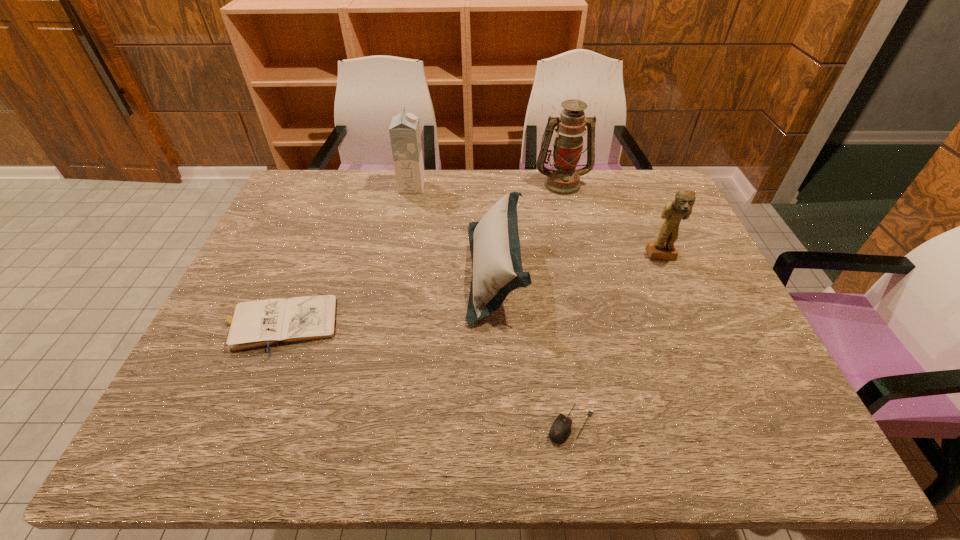
In order to click on vacant region between the figurine and the leftmost object in this screenshot , I will do `click(469, 291)`.

This screenshot has height=540, width=960. Identify the location of free area in between the nearest object and the oil lamp. (566, 303).

Identify the location of free space between the leftmost object and the carton. (346, 256).

Image resolution: width=960 pixels, height=540 pixels. Identify the location of free spot between the third object from left to right and the oil lamp. (529, 228).

Point out which object is positioned as the third nearest to the third tallest object. Please provide its 2D coordinates. Your answer should be formatted as a tuple, i.e. [(x, y)], where the tuple contains the x and y coordinates of a point satisfying the conditions above.

[(560, 430)]

Identify the location of object that is the third closest to the leftmost object. (560, 430).

Image resolution: width=960 pixels, height=540 pixels. I want to click on vacant space that satisfies the following two spatial constraints: 1. on the front label of the second object from left to right; 2. on the back side of the mouse, so click(366, 423).

The width and height of the screenshot is (960, 540). What are the coordinates of `free space that satisfies the following two spatial constraints: 1. on the front label of the second object from left to right; 2. on the left side of the mouse` in the screenshot? It's located at (366, 423).

Locate an element on the screen. free space that satisfies the following two spatial constraints: 1. on the front-facing side of the figurine; 2. on the surface of the cushion is located at coordinates (668, 272).

Identify the location of free space in the image that satisfies the following two spatial constraints: 1. on the front side of the oil lamp; 2. on the surface of the third shortest object. This screenshot has width=960, height=540. [x=583, y=272].